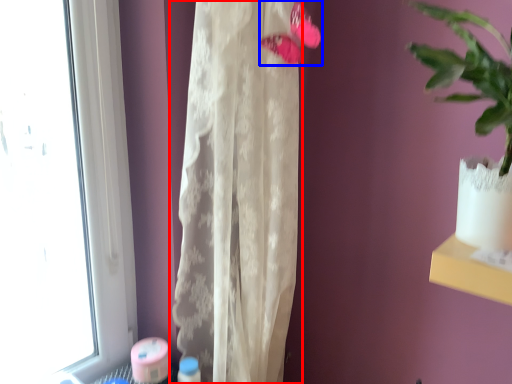
Question: Which of the following is the closest to the observer, curtain (highlighted by a red box) or flower (highlighted by a blue box)?

Choices:
 (A) curtain
 (B) flower

Answer: (A)